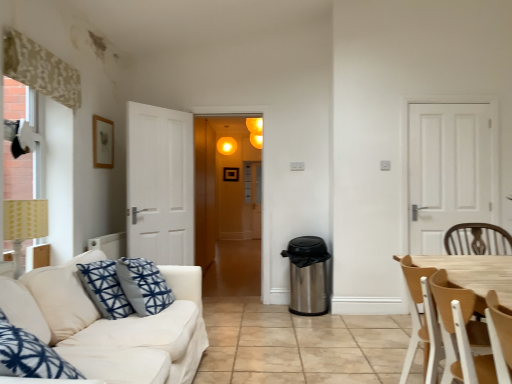
Question: From the image's perspective, would you say white fabric couch at lower left is positioned over blue printed cushion at left, positioned as the first pillow in right-to-left order?

Choices:
 (A) yes
 (B) no

Answer: (B)

Question: Is white fabric couch at lower left far from blue printed cushion at left, positioned as the first pillow in right-to-left order?

Choices:
 (A) yes
 (B) no

Answer: (B)

Question: Can we say white fabric couch at lower left lies outside blue printed cushion at left, which ranks as the 2th pillow in left-to-right order?

Choices:
 (A) no
 (B) yes

Answer: (B)

Question: Does white fabric couch at lower left have a greater height compared to blue printed cushion at left, positioned as the first pillow in right-to-left order?

Choices:
 (A) no
 (B) yes

Answer: (B)

Question: Does white fabric couch at lower left have a lesser width compared to blue printed cushion at left, positioned as the first pillow in right-to-left order?

Choices:
 (A) yes
 (B) no

Answer: (B)

Question: From the image's perspective, is white fabric couch at lower left below blue printed cushion at left, positioned as the first pillow in right-to-left order?

Choices:
 (A) yes
 (B) no

Answer: (A)

Question: Is matte yellow light at upper center facing towards matte yellow lampshade at left?

Choices:
 (A) no
 (B) yes

Answer: (B)

Question: Is matte yellow light at upper center at the left side of matte yellow lampshade at left?

Choices:
 (A) no
 (B) yes

Answer: (A)

Question: Considering the relative sizes of matte yellow light at upper center and matte yellow lampshade at left in the image provided, is matte yellow light at upper center thinner than matte yellow lampshade at left?

Choices:
 (A) yes
 (B) no

Answer: (A)

Question: From a real-world perspective, is matte yellow light at upper center positioned under matte yellow lampshade at left based on gravity?

Choices:
 (A) yes
 (B) no

Answer: (B)

Question: Considering the relative sizes of matte yellow light at upper center and matte yellow lampshade at left in the image provided, is matte yellow light at upper center shorter than matte yellow lampshade at left?

Choices:
 (A) no
 (B) yes

Answer: (B)

Question: Is matte yellow lampshade at left located within matte yellow light at upper center?

Choices:
 (A) no
 (B) yes

Answer: (A)

Question: Is white fabric couch at lower left at the back of blue printed cushion at left, positioned as the first pillow in right-to-left order?

Choices:
 (A) no
 (B) yes

Answer: (B)